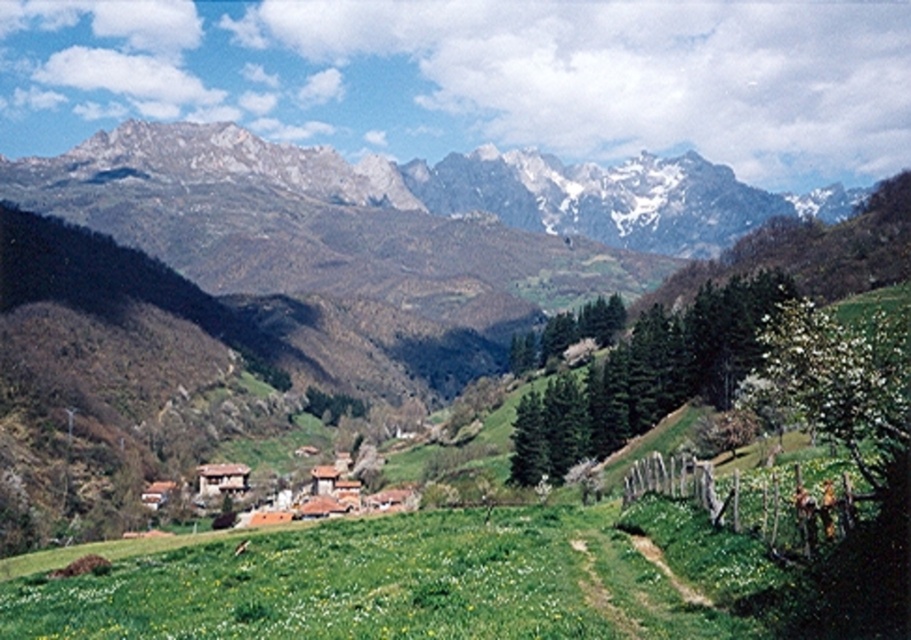
You are a hiker standing in the meadow and want to take a photo of both the rugged stone mountain range at upper center and the brown clay houses at center. Which direction should you face to include both in your frame?

To include both the rugged stone mountain range at upper center and the brown clay houses at center in your frame, you should face towards the right since the rugged stone mountain range at upper center is located to the right of the brown clay houses at center.

You are an architect designing a new eco village. You want to build a new house that is twice as large as the brown clay houses at center. Will the rugged stone mountain range at upper center be able to accommodate this new house without overlapping?

The rugged stone mountain range at upper center is already larger than the brown clay houses at center. However, the mountain range is located at the upper center of the scene, so building a new house twice as large as the brown clay houses at center would likely require space in the foreground or midground, not the mountain area. The mountain itself may not need to accommodate the new house since it is part of the background landscape.

You are standing at the base of the rugged stone mountain range at upper center and want to hike to the top. If the average hiking speed is 2 mph, how long would it take you to reach the summit?

The rugged stone mountain range at upper center and viewer are 1874.31 feet apart from each other. Converting feet to miles, 1874.31 feet is approximately 0.355 miles. At an average hiking speed of 2 mph, it would take roughly 10.65 minutes to reach the summit.